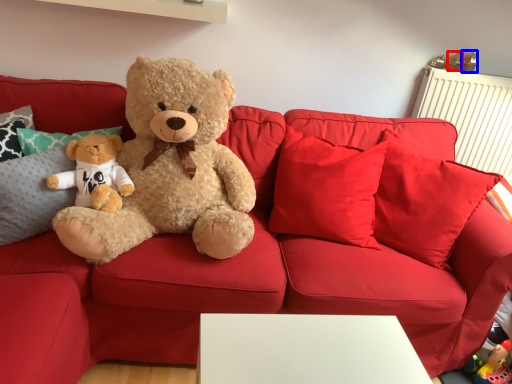
Question: Among these objects, which one is nearest to the camera, toy (highlighted by a red box) or toy (highlighted by a blue box)?

Choices:
 (A) toy
 (B) toy

Answer: (A)